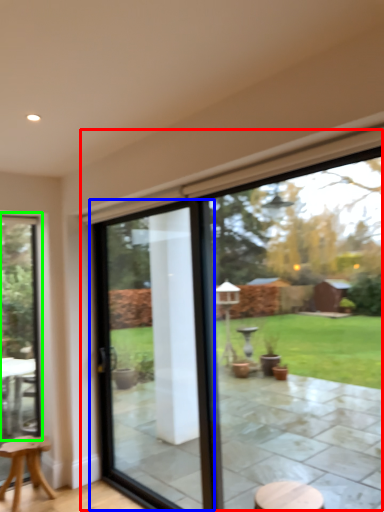
Question: Which is nearer to the window (highlighted by a red box)? screen door (highlighted by a blue box) or window (highlighted by a green box).

Choices:
 (A) screen door
 (B) window

Answer: (A)